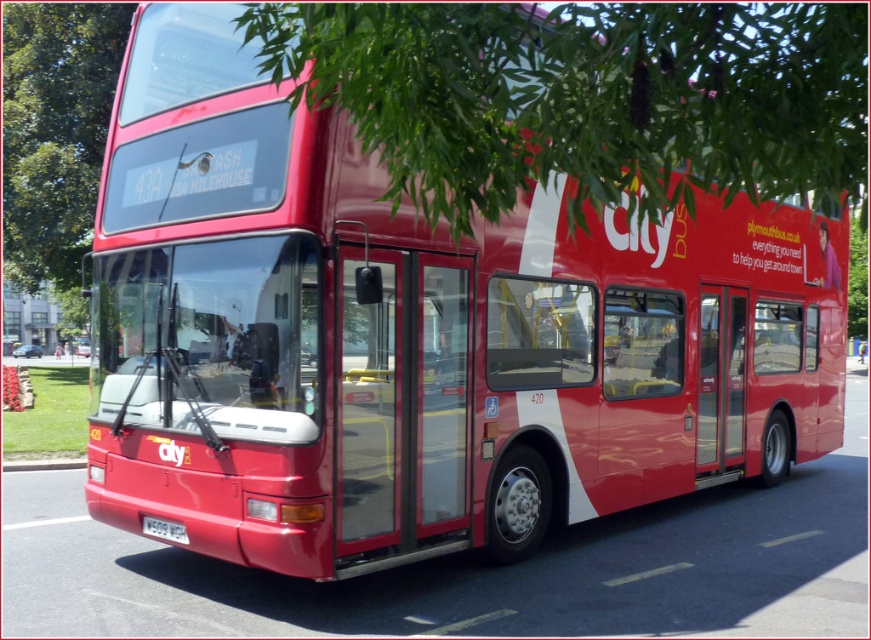
Is point (539, 102) farther from camera compared to point (147, 518)?

No.

Is point (755, 122) less distant than point (169, 540)?

Yes.

Between point (342, 8) and point (152, 522), which one is positioned in front?

Point (342, 8) is in front.

This screenshot has width=871, height=640. Find the location of `green leafy tree at upper center`. green leafy tree at upper center is located at coordinates (584, 99).